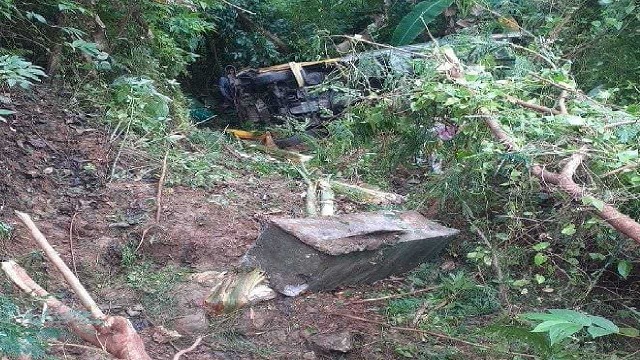
Locate an element on the screen. plant leaves is located at coordinates (540, 259), (625, 266), (541, 245), (570, 227), (539, 278), (486, 258), (477, 253).